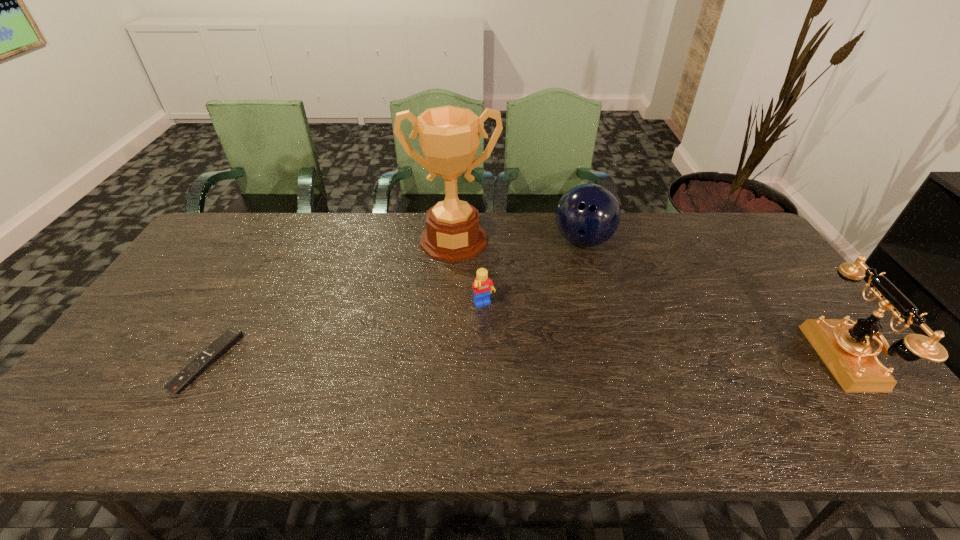
Locate an element on the screen. This screenshot has height=540, width=960. vacant area between the second object from right to left and the fourth tallest object is located at coordinates (534, 273).

Where is `unoccupied position between the fourth object from left to right and the leftmost object`? unoccupied position between the fourth object from left to right and the leftmost object is located at coordinates pyautogui.click(x=395, y=301).

What are the coordinates of `vacant area between the shortest object and the rightmost object` in the screenshot? It's located at (528, 360).

This screenshot has height=540, width=960. I want to click on free space between the shortest object and the award, so click(x=330, y=301).

I want to click on vacant point located between the telephone and the third shortest object, so click(715, 300).

At what (x,y) coordinates should I click in order to perform the action: click on vacant space that's between the shortest object and the rightmost object. Please return your answer as a coordinate pair (x, y). The height and width of the screenshot is (540, 960). Looking at the image, I should click on (528, 360).

Identify the location of free space between the telephone and the third farthest object. This screenshot has width=960, height=540. (666, 333).

Where is `free area in between the Lego and the telephone`? free area in between the Lego and the telephone is located at coordinates (666, 333).

At what (x,y) coordinates should I click in order to perform the action: click on free space between the leftmost object and the award. Please return your answer as a coordinate pair (x, y). Looking at the image, I should click on (330, 301).

Identify the location of free space between the second object from right to left and the tallest object. The image size is (960, 540). (518, 241).